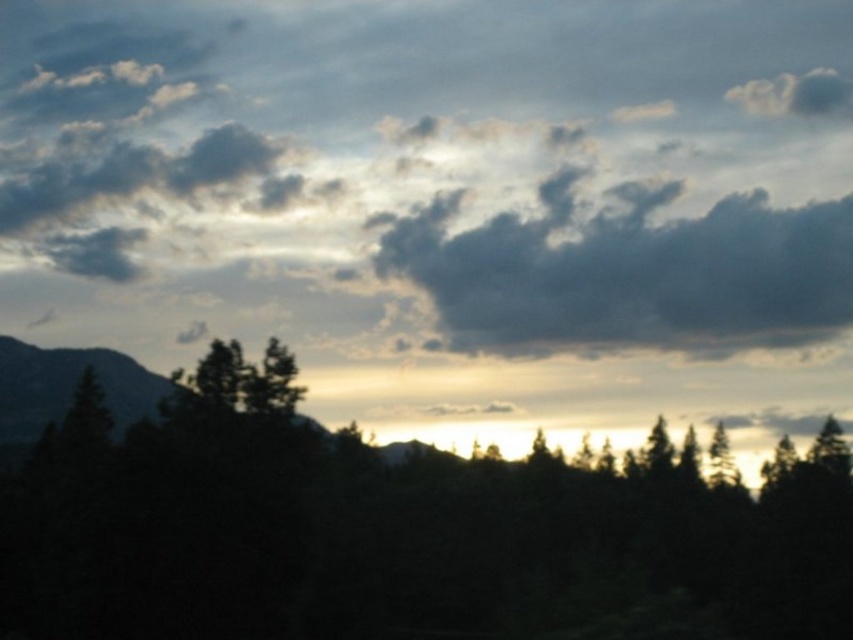
Question: Considering the real-world distances, which object is farthest from the dark gray fluffy cloud at upper center?

Choices:
 (A) dark gray rocky mountain at left
 (B) green matte tree at center

Answer: (A)

Question: Does dark green foliage at center have a greater width compared to dark gray rocky mountain at left?

Choices:
 (A) yes
 (B) no

Answer: (A)

Question: Which point is closer to the camera?

Choices:
 (A) dark gray rocky mountain at left
 (B) dark green foliage at center
 (C) green matte tree at center

Answer: (B)

Question: Is dark green foliage at center above green matte tree at center?

Choices:
 (A) no
 (B) yes

Answer: (B)

Question: Can you confirm if dark gray fluffy cloud at upper center is positioned below green matte tree at center?

Choices:
 (A) no
 (B) yes

Answer: (A)

Question: Which object is the closest to the dark green foliage at center?

Choices:
 (A) green matte tree at center
 (B) dark gray fluffy cloud at upper center
 (C) dark gray rocky mountain at left

Answer: (C)